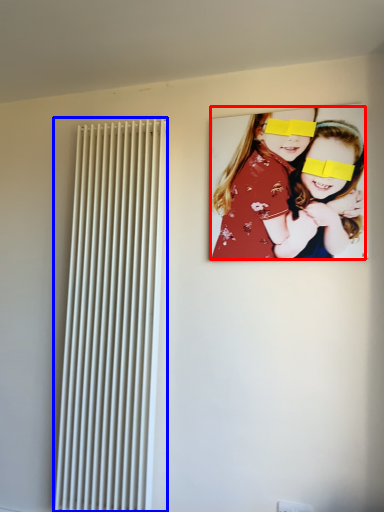
Question: Among these objects, which one is farthest to the camera, girl (highlighted by a red box) or radiator (highlighted by a blue box)?

Choices:
 (A) girl
 (B) radiator

Answer: (B)